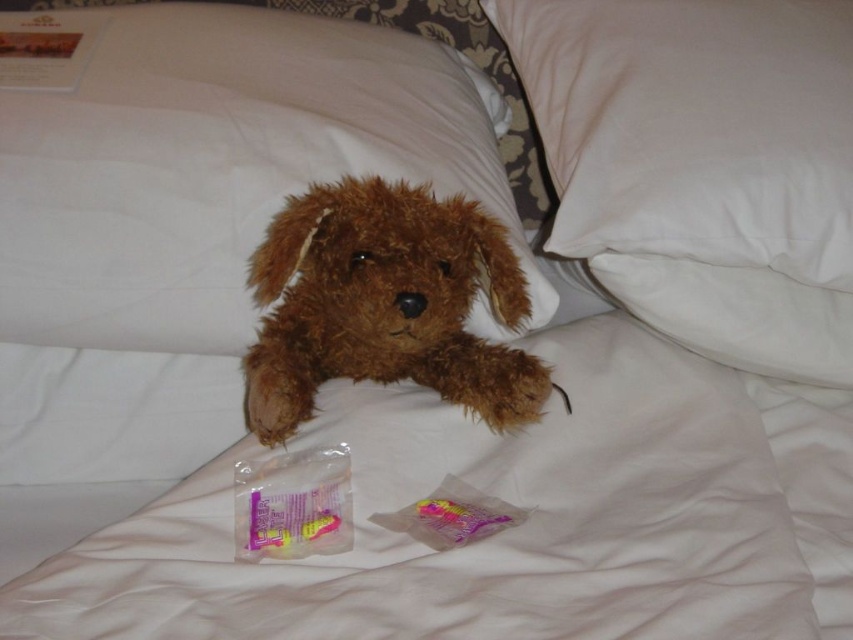
Question: Estimate the real-world distances between objects in this image. Which object is closer to the brown plush toy at center?

Choices:
 (A) white soft pillow at upper right
 (B) white cotton pillow at upper right
 (C) brown plush at upper center

Answer: (C)

Question: Can you confirm if white soft pillow at upper right is wider than white cotton pillow at upper right?

Choices:
 (A) no
 (B) yes

Answer: (B)

Question: Does white soft pillow at upper right come behind brown plush toy at center?

Choices:
 (A) no
 (B) yes

Answer: (B)

Question: Which object is positioned farthest from the brown plush at upper center?

Choices:
 (A) white soft pillow at upper right
 (B) brown plush toy at center
 (C) white cotton pillow at upper right

Answer: (C)

Question: Does brown plush at upper center lie behind white soft pillow at upper right?

Choices:
 (A) yes
 (B) no

Answer: (B)

Question: Which point appears closest to the camera in this image?

Choices:
 (A) (689, 264)
 (B) (631, 248)
 (C) (485, 275)

Answer: (C)